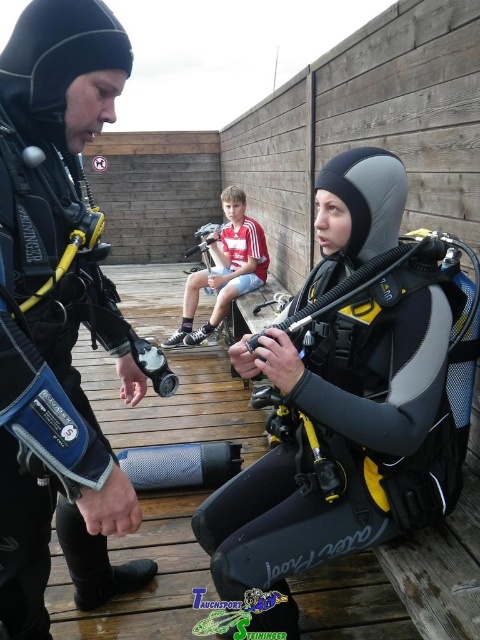
Question: Which point is farther to the camera?

Choices:
 (A) (12, 621)
 (B) (222, 237)

Answer: (B)

Question: Is matte black wetsuit at left bigger than red striped shirt at center?

Choices:
 (A) yes
 (B) no

Answer: (B)

Question: Which object is the closest to the matte black wetsuit at left?

Choices:
 (A) matte black wetsuit at center
 (B) red striped shirt at center

Answer: (A)

Question: Can you confirm if matte black wetsuit at center is smaller than red striped shirt at center?

Choices:
 (A) yes
 (B) no

Answer: (A)

Question: Does matte black wetsuit at center appear under red striped shirt at center?

Choices:
 (A) yes
 (B) no

Answer: (A)

Question: Which of these objects is positioned closest to the matte black wetsuit at center?

Choices:
 (A) matte black wetsuit at left
 (B) red striped shirt at center

Answer: (A)